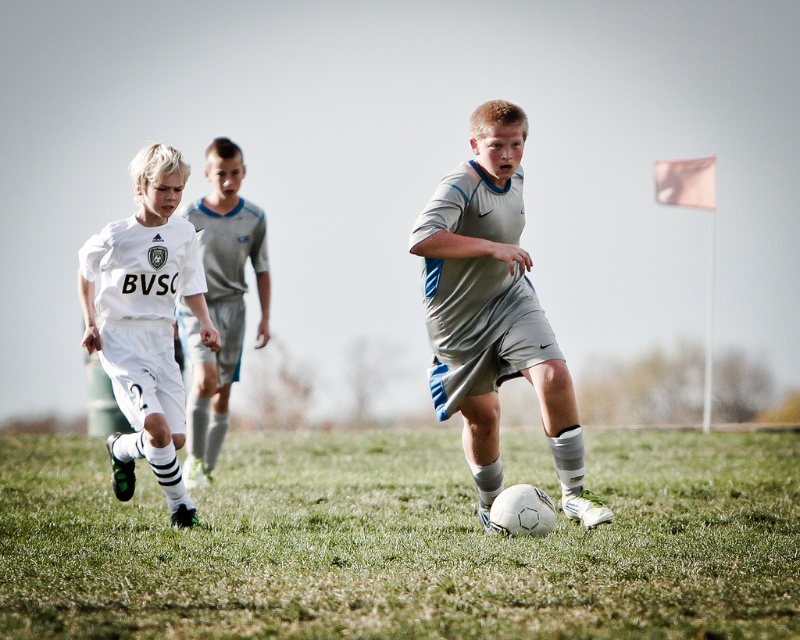
You are a soccer coach analyzing the field layout. You notice the green grass at center and the white matte soccer uniform at left. Which area is wider in terms of horizontal space?

The green grass at center is wider than the white matte soccer uniform at left according to the description.

You are a soccer coach analyzing the field layout. You notice the green grass at center and the gray matte shorts at center. Which one has a greater width in the image?

The green grass at center has a greater width than the gray matte shorts at center according to the description.